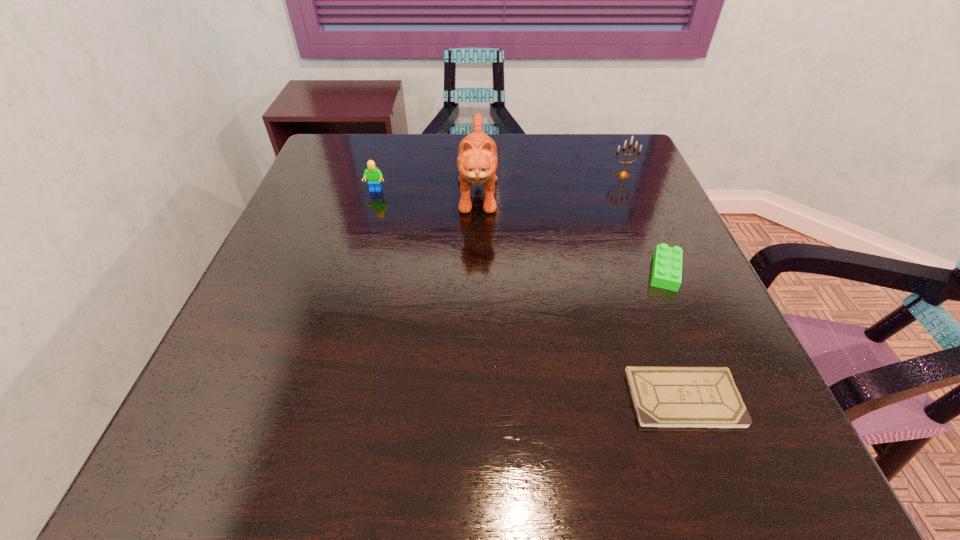
The image size is (960, 540). I want to click on cat, so click(477, 161).

Identify the location of the fourth object from right to left. tap(477, 161).

Image resolution: width=960 pixels, height=540 pixels. Find the location of `the fourth shortest object`. the fourth shortest object is located at coordinates (623, 174).

This screenshot has height=540, width=960. I want to click on the leftmost object, so (373, 174).

This screenshot has width=960, height=540. In order to click on the taller Lego in this screenshot , I will do `click(373, 174)`.

Find the location of a particular element. The image size is (960, 540). the fourth farthest object is located at coordinates (667, 262).

Where is `the shorter Lego`? the shorter Lego is located at coordinates (667, 262).

The width and height of the screenshot is (960, 540). In order to click on checkbook in this screenshot , I will do `click(664, 397)`.

The width and height of the screenshot is (960, 540). Find the location of `the nearest object`. the nearest object is located at coordinates (664, 397).

Identify the location of free space located on the face of the fourth object from right to left. Image resolution: width=960 pixels, height=540 pixels. (477, 353).